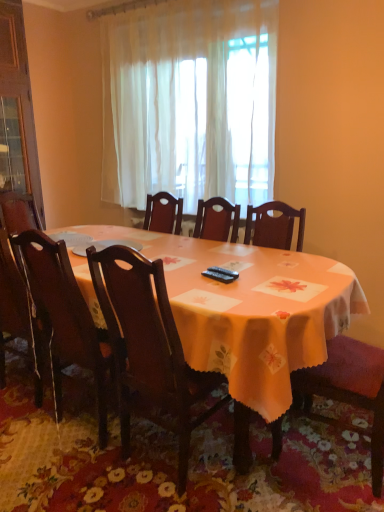
Question: From a real-world perspective, is floral fabric tablecloth at center physically located above or below dark wood chair at center, the second chair when ordered from right to left?

Choices:
 (A) above
 (B) below

Answer: (B)

Question: From the image's perspective, is floral fabric tablecloth at center located above or below dark wood chair at center, placed as the 2th chair when sorted from left to right?

Choices:
 (A) above
 (B) below

Answer: (B)

Question: Estimate the real-world distances between objects in this image. Which object is farther from the orange fabric table at center?

Choices:
 (A) floral fabric tablecloth at center
 (B) dark wood chair at center, the second chair when ordered from right to left
 (C) white sheer curtain at center
 (D) dark wood chair at left, the 3th chair positioned from the right
 (E) wooden chair at right, which is counted as the third chair, starting from the left

Answer: (C)

Question: Which object is the closest to the orange fabric table at center?

Choices:
 (A) wooden chair at right, which is counted as the third chair, starting from the left
 (B) white sheer curtain at center
 (C) dark wood chair at left, the 3th chair positioned from the right
 (D) dark wood chair at center, the second chair when ordered from right to left
 (E) floral fabric tablecloth at center

Answer: (D)